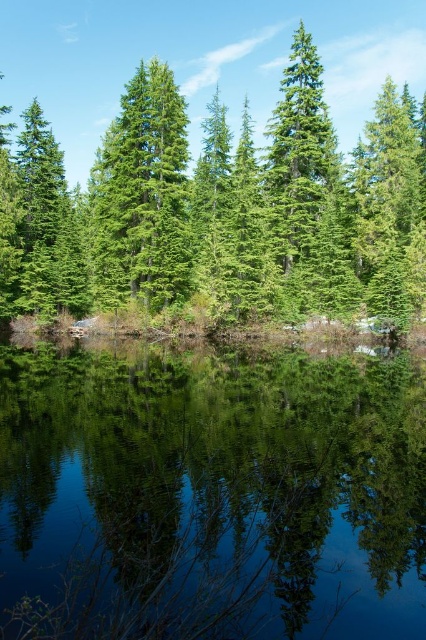
You are a hiker who wants to take a photo of the green reflective water at center and the green matte tree at center from a distance. Which object will appear smaller in the photo?

The green reflective water at center will appear smaller in the photo because it is shorter than the green matte tree at center.